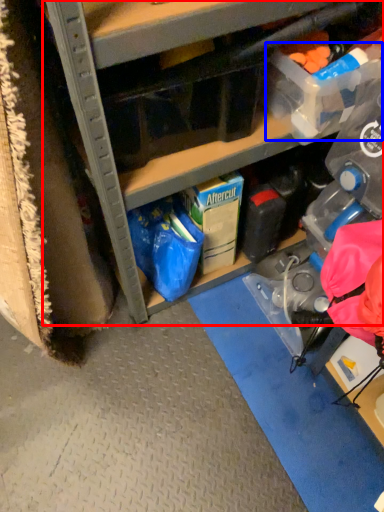
Question: Which object appears closest to the camera in this image, cabinetry (highlighted by a red box) or storage box (highlighted by a blue box)?

Choices:
 (A) cabinetry
 (B) storage box

Answer: (A)